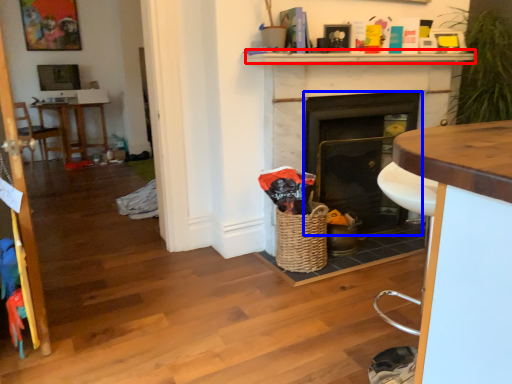
Question: Which of the following is the closest to the observer, mantle (highlighted by a red box) or fireplace (highlighted by a blue box)?

Choices:
 (A) mantle
 (B) fireplace

Answer: (A)